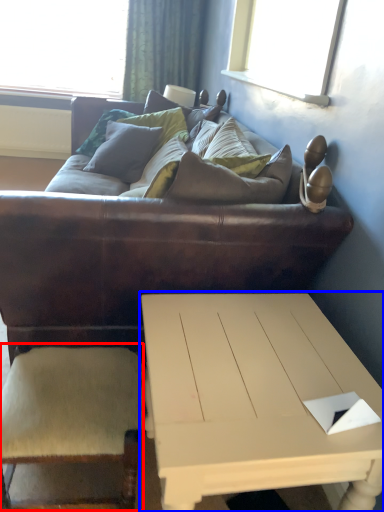
Question: Among these objects, which one is farthest to the camera, armchair (highlighted by a red box) or coffee table (highlighted by a blue box)?

Choices:
 (A) armchair
 (B) coffee table

Answer: (A)